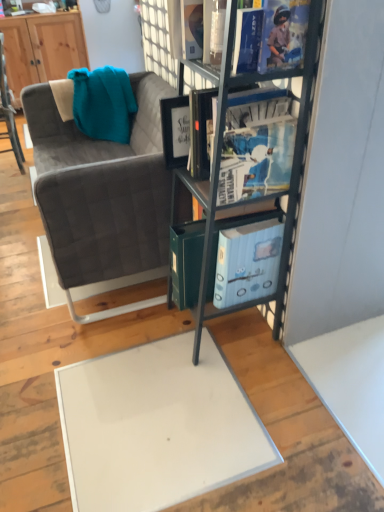
Question: From their relative heights in the image, would you say metallic gray bookshelf at center is taller or shorter than blue glossy book at upper center?

Choices:
 (A) tall
 (B) short

Answer: (A)

Question: From the image's perspective, is metallic gray bookshelf at center located above or below blue glossy book at upper center?

Choices:
 (A) above
 (B) below

Answer: (B)

Question: Considering the real-world distances, which object is farthest from the wooden cabinet at upper left?

Choices:
 (A) blue glossy book at upper center
 (B) velvet grey couch at left
 (C) velvet grey chair at left
 (D) metallic gray bookshelf at center

Answer: (A)

Question: Which is nearer to the metallic gray bookshelf at center?

Choices:
 (A) blue glossy book at upper center
 (B) velvet grey chair at left
 (C) wooden cabinet at upper left
 (D) velvet grey couch at left

Answer: (A)